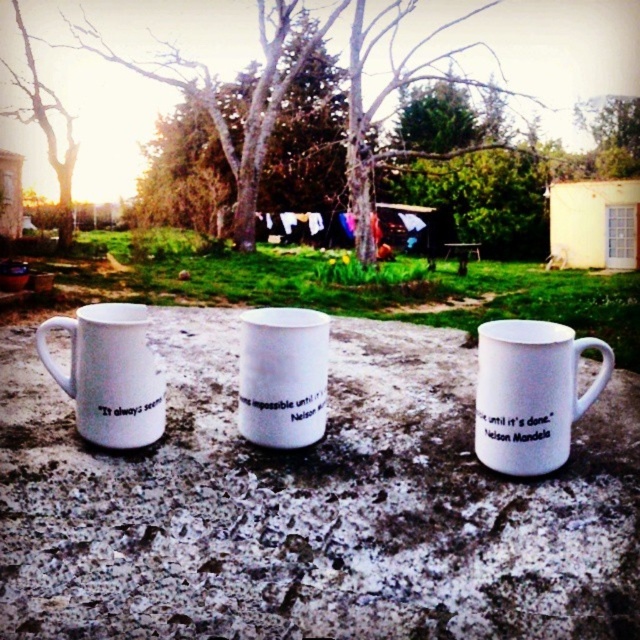
Question: Which point appears closest to the camera in this image?

Choices:
 (A) (268, 360)
 (B) (492, 362)

Answer: (B)

Question: Is white ceramic mug at center further to camera compared to white matte mug at left?

Choices:
 (A) no
 (B) yes

Answer: (A)

Question: Which point is closer to the camera taking this photo?

Choices:
 (A) (266, 323)
 (B) (573, 339)
 (C) (160, 429)

Answer: (B)

Question: Can you confirm if white matte mug at left is positioned below white matte mug at center?

Choices:
 (A) yes
 (B) no

Answer: (B)

Question: Among these objects, which one is farthest from the camera?

Choices:
 (A) white ceramic mug at center
 (B) white matte mug at center

Answer: (B)

Question: Is white ceramic mug at center wider than white matte mug at left?

Choices:
 (A) yes
 (B) no

Answer: (B)